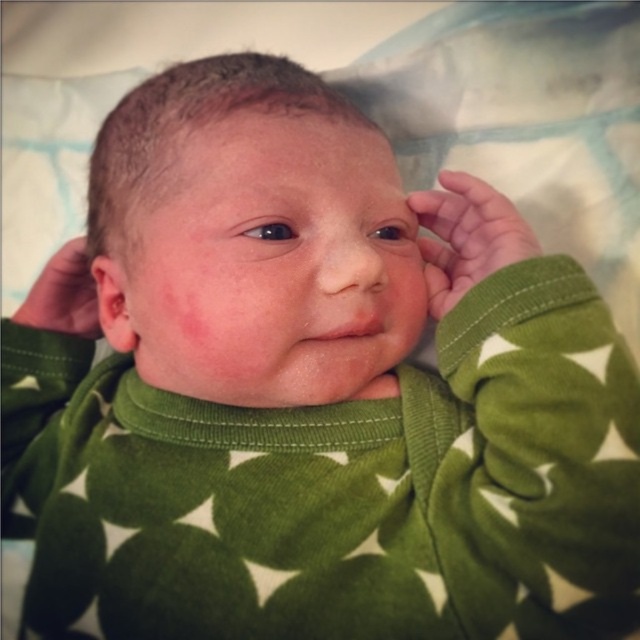
You are a photographer trying to capture the baby in the image. You want to adjust your camera to focus on the green soft fabric hand at upper right and the skinny green fabric at left. Which object should you focus on first if you want to capture both in the same frame without moving the camera?

The green soft fabric hand at upper right should be focused on first because it is closer to the camera than the skinny green fabric at left, allowing both to be in focus when using a shallow depth of field.

Based on the scene description, where is the skinny green fabric at left located in terms of coordinates?

The skinny green fabric at left is located at coordinates point [64,294].

You are a photographer setting up for a baby photoshoot. The baby is wearing a green onesie with white stars and is positioned on a light blue and white patterned blanket. You notice the green soft fabric hand at upper right and the skinny green fabric at left in the scene. To ensure the baby stays comfortable, you need to adjust the distance between these two green fabric parts. What is the minimum distance you should maintain between them?

The minimum distance you should maintain between the green soft fabric hand at upper right and the skinny green fabric at left is 35.83 centimeters, as they are currently positioned 35.83 centimeters apart.